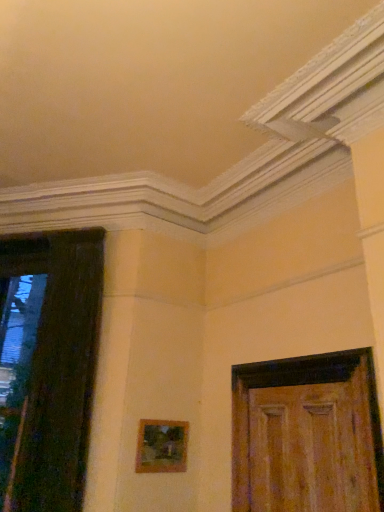
Question: Considering the positions of point (326, 391) and point (39, 288), is point (326, 391) closer or farther from the camera than point (39, 288)?

Choices:
 (A) closer
 (B) farther

Answer: (A)

Question: From a real-world perspective, relative to dark wood door at left, which is counted as the 1th door, starting from the left, is wooden door at right, the second door viewed from the left, vertically above or below?

Choices:
 (A) above
 (B) below

Answer: (B)

Question: Which object is the farthest from the wooden door at right, the second door viewed from the left?

Choices:
 (A) wooden frame at center
 (B) dark wood door at left, which is counted as the 1th door, starting from the left

Answer: (B)

Question: Which of these objects is positioned closest to the dark wood door at left, acting as the 2th door starting from the right?

Choices:
 (A) wooden door at right, which is the first door from right to left
 (B) wooden frame at center

Answer: (B)